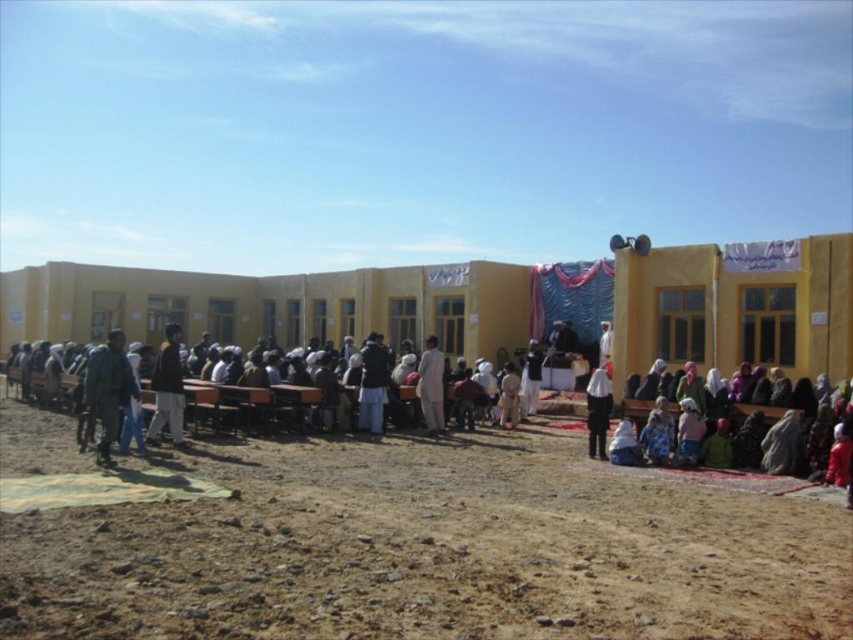
Based on the photo, you are standing at the edge of the scene and want to walk towards the stage. Which object, the brown sandy ground at lower center or the dark blue jeans at left, will you step on first?

The dark blue jeans at left will be stepped on first because the brown sandy ground at lower center occupies less space, indicating it is further away from the viewer compared to the dark blue jeans at left.